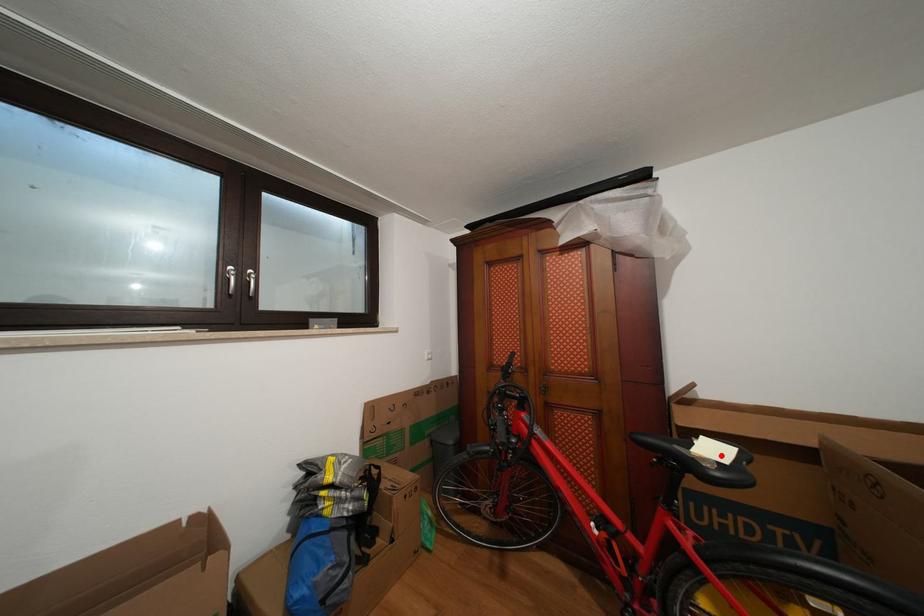
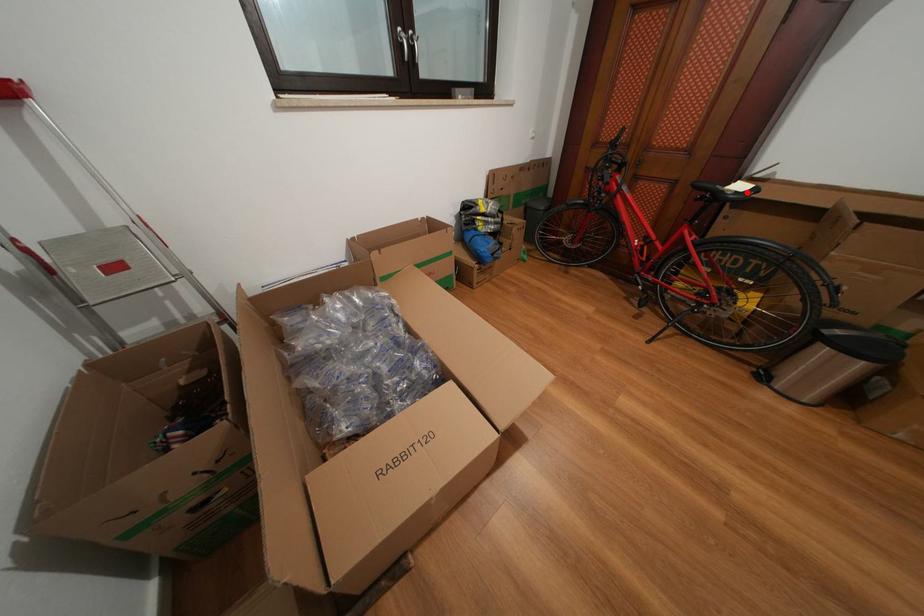
I am providing you with two images of the same scene from different viewpoints. A red point is marked on the first image and another point is marked on the second image. Is the marked point in image1 the same physical position as the marked point in image2?

Yes